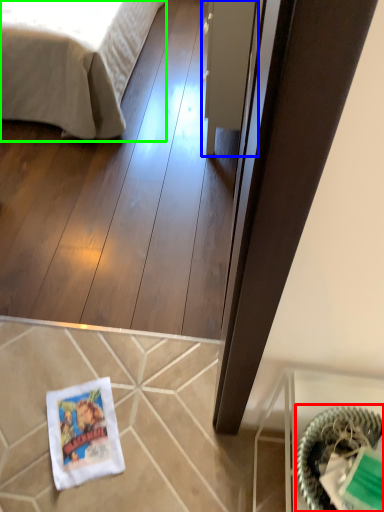
Question: Estimate the real-world distances between objects in this image. Which object is closer to basket (highlighted by a red box), glass door (highlighted by a blue box) or bed (highlighted by a green box)?

Choices:
 (A) glass door
 (B) bed

Answer: (A)